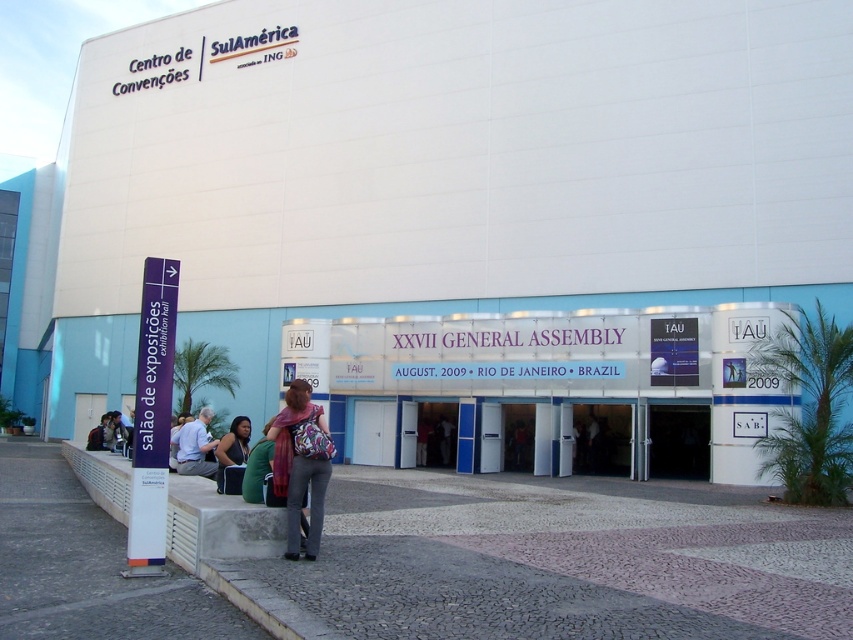
Who is positioned more to the right, white glossy signboard at center or matte black jacket at lower center?

white glossy signboard at center

In the scene shown: Between white glossy signboard at center and matte black jacket at lower center, which one appears on the left side from the viewer's perspective?

Positioned to the left is matte black jacket at lower center.

Which is in front, point (503, 452) or point (236, 456)?

Positioned in front is point (236, 456).

The image size is (853, 640). I want to click on white glossy signboard at center, so click(x=547, y=388).

Can you confirm if matte purple scarf at center is thinner than light blue fabric jacket at lower left?

Indeed, matte purple scarf at center has a lesser width compared to light blue fabric jacket at lower left.

Which of these two, matte purple scarf at center or light blue fabric jacket at lower left, stands taller?

Standing taller between the two is light blue fabric jacket at lower left.

Is point (323, 429) positioned behind point (202, 448)?

That is False.

Find the location of `matte purple scarf at center`. matte purple scarf at center is located at coordinates (299, 467).

Can you confirm if light blue fabric jacket at lower left is bigger than matte black jacket at lower center?

Actually, light blue fabric jacket at lower left might be smaller than matte black jacket at lower center.

Does light blue fabric jacket at lower left have a lesser width compared to matte black jacket at lower center?

Incorrect, light blue fabric jacket at lower left's width is not less than matte black jacket at lower center's.

You are a GUI agent. You are given a task and a screenshot of the screen. Output one action in this format:
    pyautogui.click(x=<x>, y=<y>)
    Task: Click on the light blue fabric jacket at lower left
    The width and height of the screenshot is (853, 640).
    Given the screenshot: What is the action you would take?
    pyautogui.click(x=196, y=445)

Find the location of a particular element. light blue fabric jacket at lower left is located at coordinates (x=196, y=445).